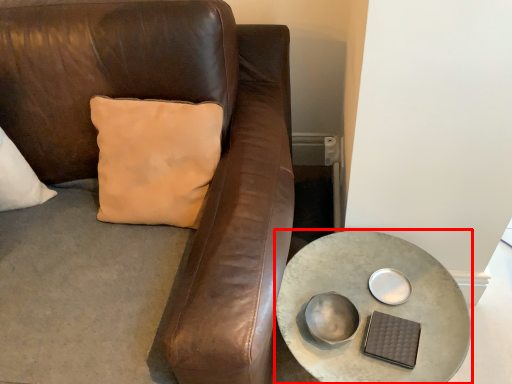
Question: From the image's perspective, where is table (annotated by the red box) located relative to bowl?

Choices:
 (A) below
 (B) above

Answer: (A)